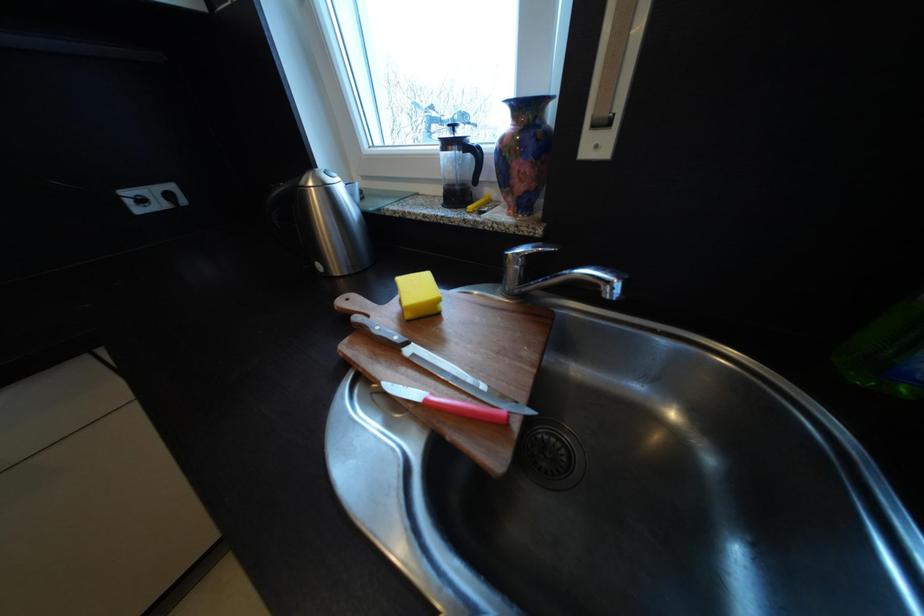
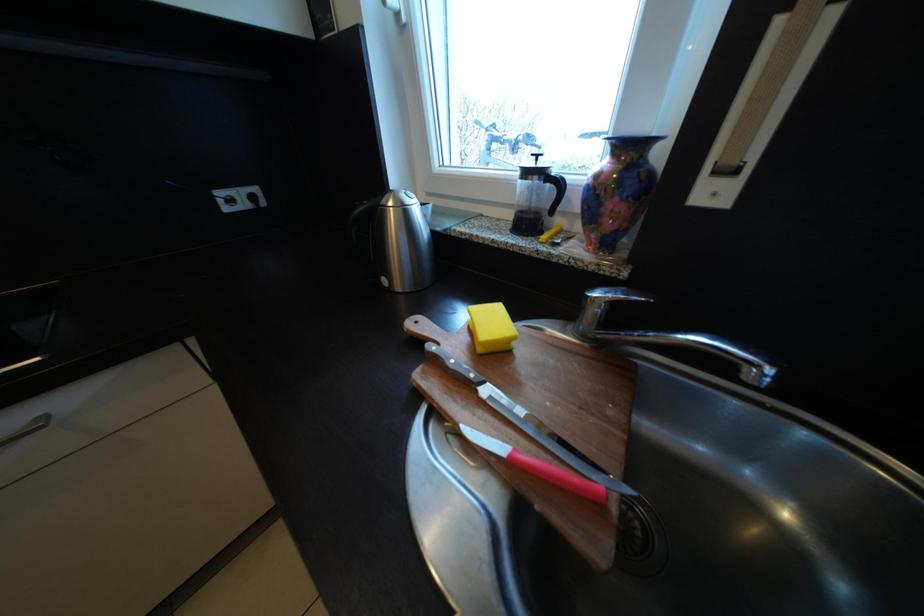
Question: What movement of the cameraman would produce the second image?

Choices:
 (A) Left
 (B) Right
 (C) Forward
 (D) Backward

Answer: (A)